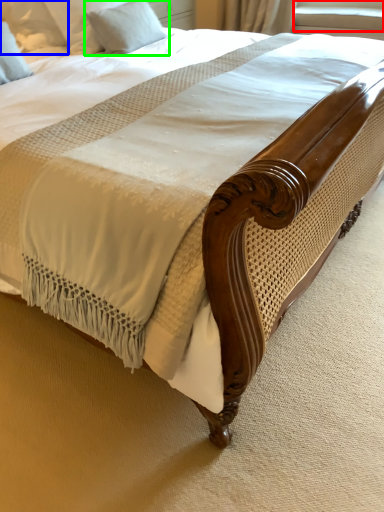
Question: Estimate the real-world distances between objects in this image. Which object is closer to window screen (highlighted by a red box), pillow (highlighted by a blue box) or pillow (highlighted by a green box)?

Choices:
 (A) pillow
 (B) pillow

Answer: (B)